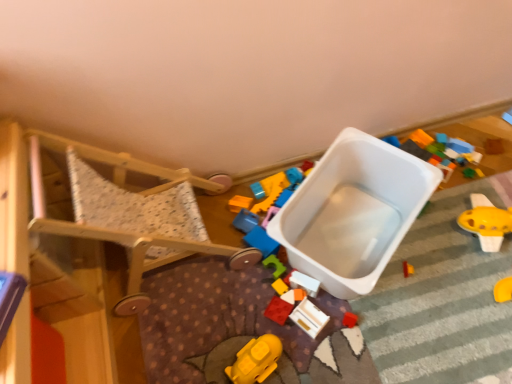
Locate an element on the screen. The width and height of the screenshot is (512, 384). vacant space that is to the left of rubber yellow toy at center, placed as the fourth toy when sorted from right to left is located at coordinates (226, 301).